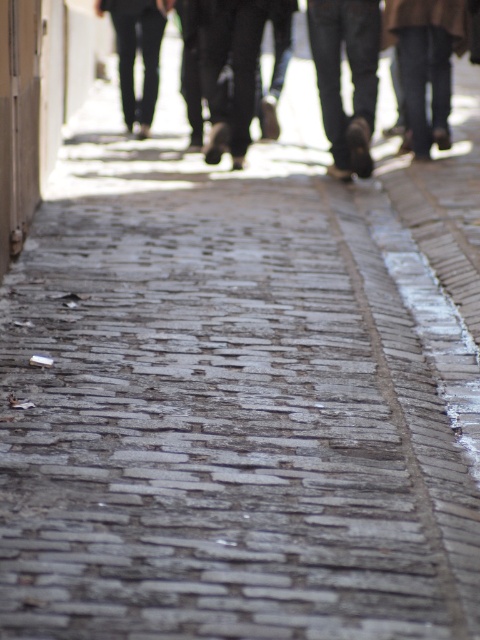
Question: Observing the image, what is the correct spatial positioning of brown leather shoes at upper center in reference to dark denim jeans at center?

Choices:
 (A) below
 (B) above

Answer: (B)

Question: Estimate the real-world distances between objects in this image. Which object is closer to the dark denim jeans at center?

Choices:
 (A) dark brown leather shoes at upper right
 (B) brown leather shoes at upper center
 (C) dark gray pants at center

Answer: (A)

Question: Which of these objects is positioned closest to the dark denim jeans at center?

Choices:
 (A) dark brown leather shoes at upper right
 (B) brown leather shoes at upper center

Answer: (A)

Question: Can you confirm if dark brown leather shoes at upper right is thinner than dark gray pants at center?

Choices:
 (A) yes
 (B) no

Answer: (A)

Question: Where is dark denim jeans at center located in relation to dark brown leather shoes at upper right in the image?

Choices:
 (A) left
 (B) right

Answer: (A)

Question: Among these objects, which one is nearest to the camera?

Choices:
 (A) dark gray pants at center
 (B) dark denim jeans at center
 (C) brown leather shoes at upper center

Answer: (C)